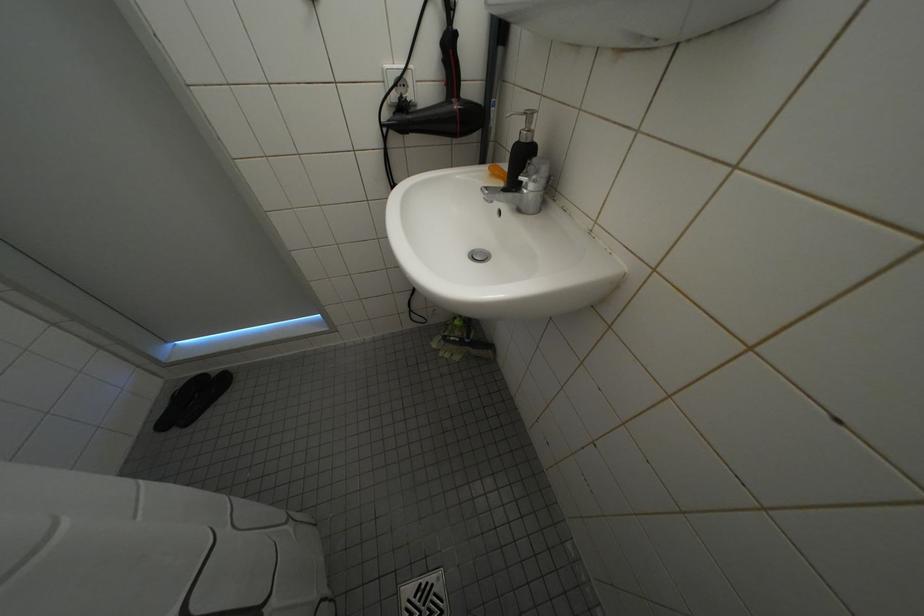
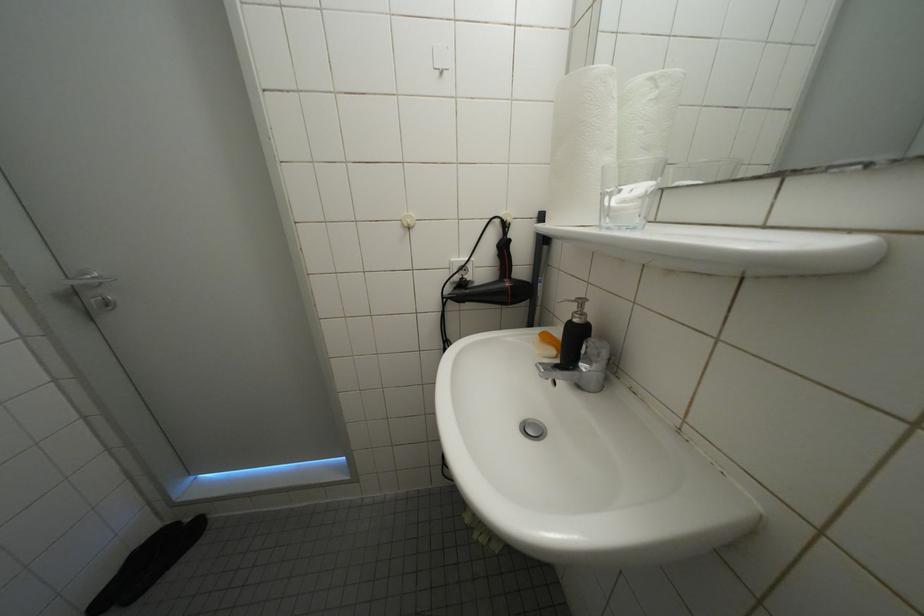
Question: Which direction would the cameraman need to move to produce the second image? Reply with the corresponding letter.

Choices:
 (A) Left
 (B) Right
 (C) Forward
 (D) Backward

Answer: (A)